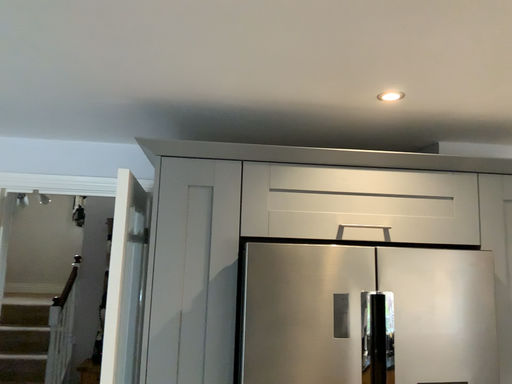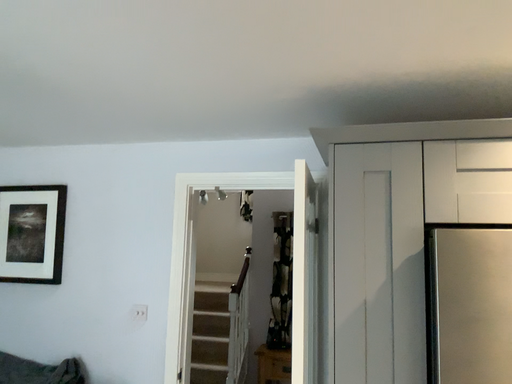
Question: Which way did the camera rotate in the video?

Choices:
 (A) rotated right
 (B) rotated left

Answer: (B)